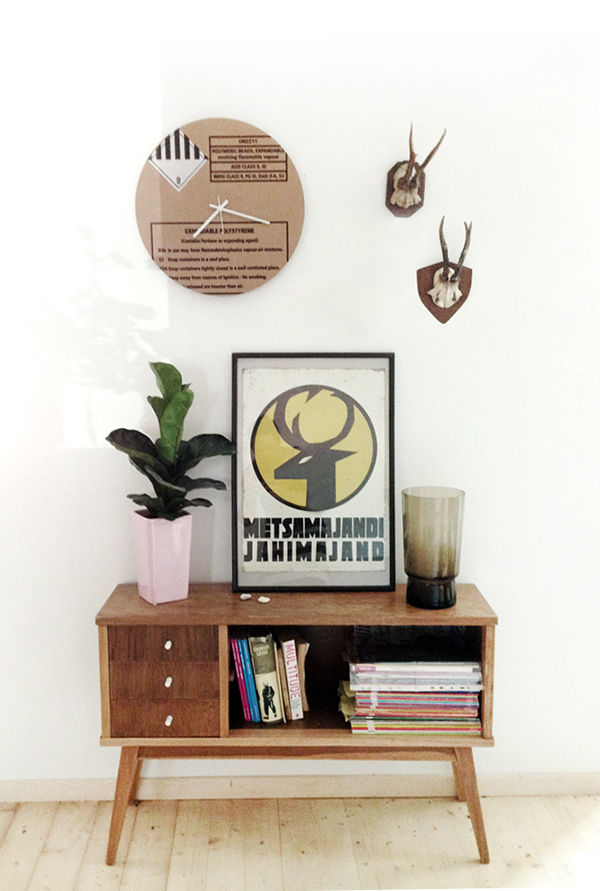
Locate an element on the screen. This screenshot has width=600, height=891. plant is located at coordinates (169, 461).